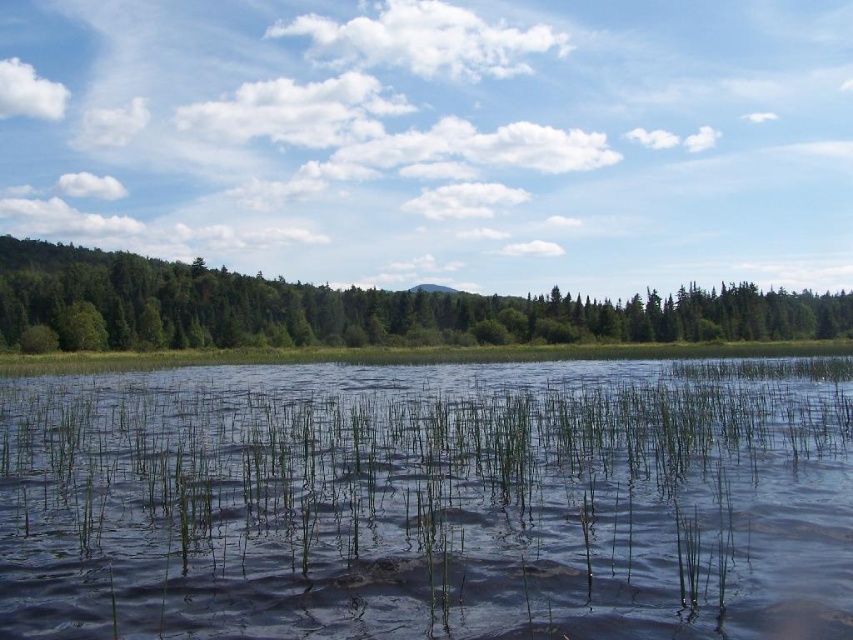
Question: Is green grassy water at center further to the viewer compared to green matte tree at left?

Choices:
 (A) no
 (B) yes

Answer: (A)

Question: Does green grassy water at center have a smaller size compared to green matte tree at left?

Choices:
 (A) yes
 (B) no

Answer: (A)

Question: Among these objects, which one is nearest to the camera?

Choices:
 (A) green grassy water at center
 (B) green matte tree at left

Answer: (A)

Question: Which point appears farthest from the camera in this image?

Choices:
 (A) 822,300
 (B) 782,572

Answer: (A)

Question: In this image, where is green grassy water at center located relative to green matte tree at left?

Choices:
 (A) below
 (B) above

Answer: (A)